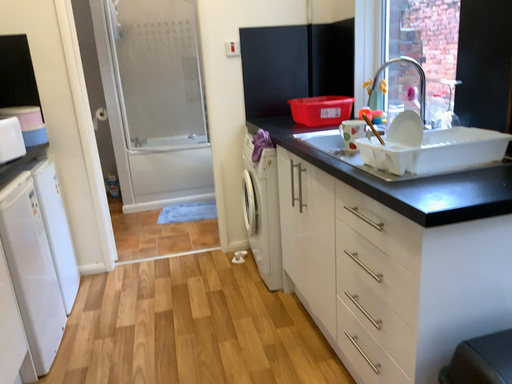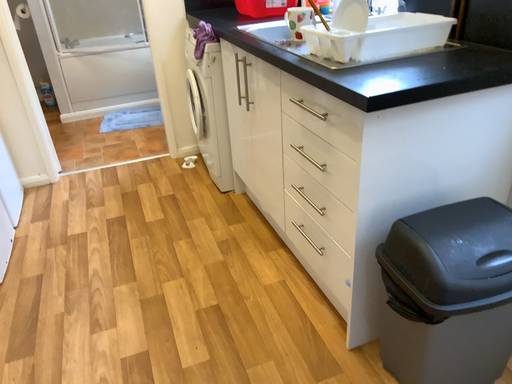
Question: Which way did the camera rotate in the video?

Choices:
 (A) rotated left
 (B) rotated right

Answer: (B)